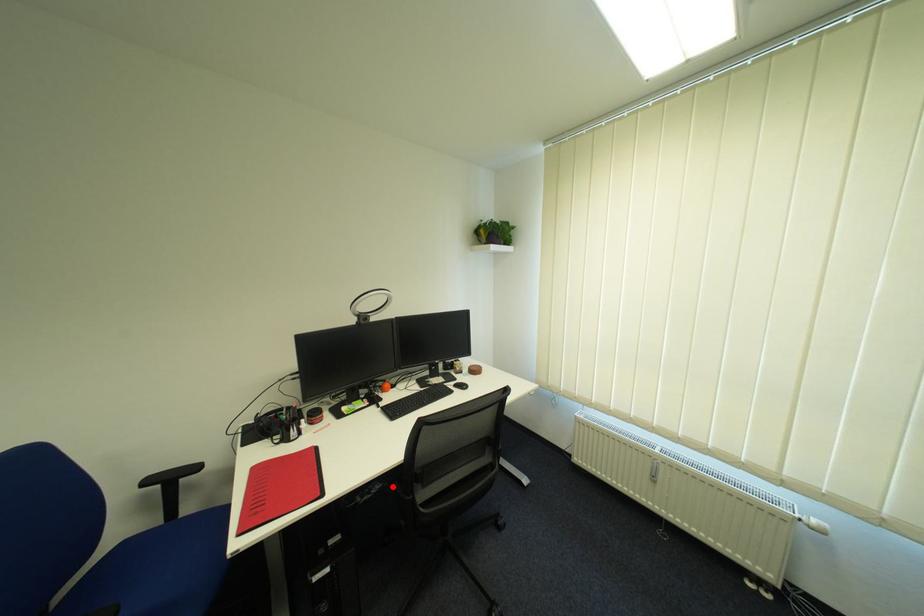
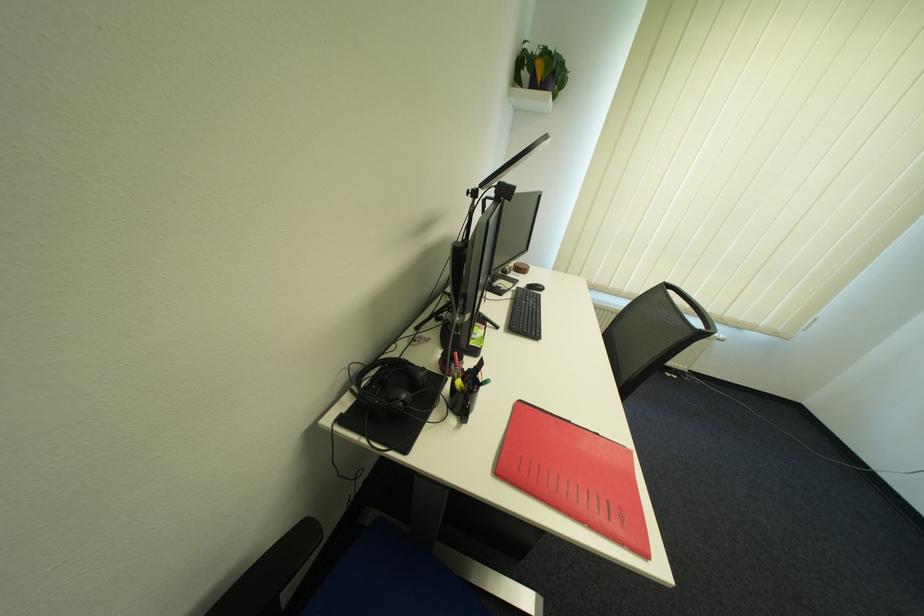
Question: I am providing you with two images of the same scene from different viewpoints. A red point is marked on the first image. Is the red point's position out of view in image 2?

Choices:
 (A) Yes
 (B) No

Answer: (A)